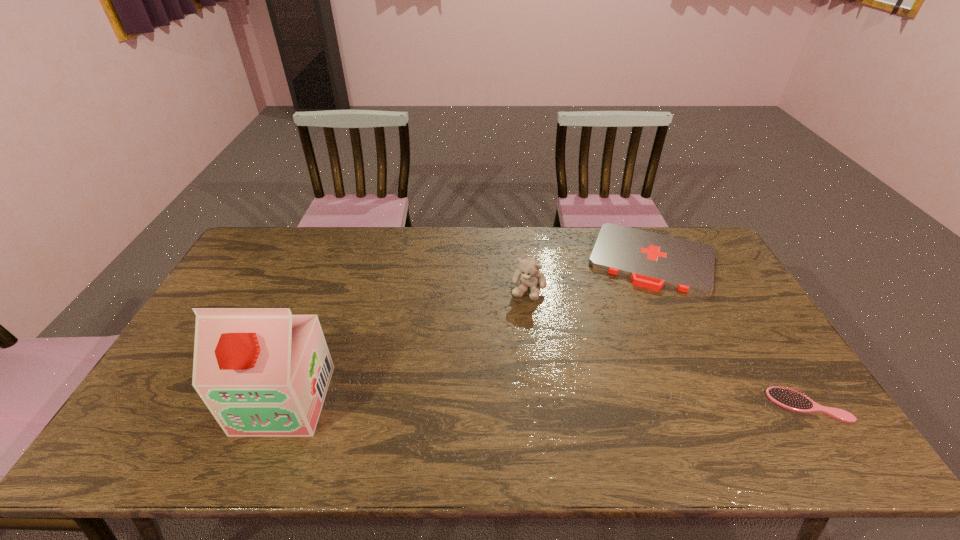
Locate an element on the screen. This screenshot has height=540, width=960. free space located on handle side the first-aid kit is located at coordinates (632, 332).

The height and width of the screenshot is (540, 960). I want to click on vacant space located 0.300m on handle side the first-aid kit, so click(625, 362).

Identify the location of vacant space located on handle side the first-aid kit. (632, 332).

What are the coordinates of `object that is at the far edge` in the screenshot? It's located at (651, 260).

Locate an element on the screen. This screenshot has width=960, height=540. soya milk that is positioned at the near edge is located at coordinates (262, 372).

This screenshot has width=960, height=540. What are the coordinates of `hairbrush located in the near edge section of the desktop` in the screenshot? It's located at (787, 398).

Where is `hairbrush located at the right edge`? hairbrush located at the right edge is located at coordinates (787, 398).

At what (x,y) coordinates should I click in order to perform the action: click on the first-aid kit present at the right edge. Please return your answer as a coordinate pair (x, y). The image size is (960, 540). Looking at the image, I should click on (651, 260).

At what (x,y) coordinates should I click in order to perform the action: click on object situated at the far right corner. Please return your answer as a coordinate pair (x, y). The width and height of the screenshot is (960, 540). Looking at the image, I should click on (651, 260).

Locate an element on the screen. object located at the near right corner is located at coordinates coord(787,398).